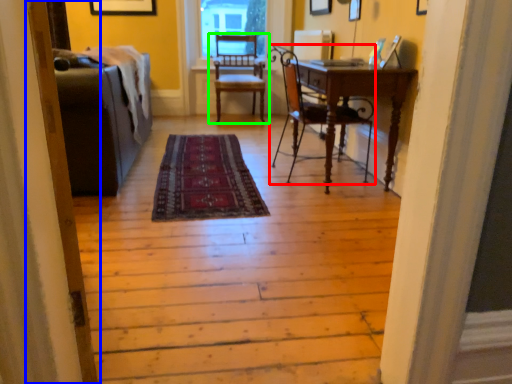
Question: Considering the real-world distances, which object is farthest from chair (highlighted by a red box)? screen door (highlighted by a blue box) or chair (highlighted by a green box)?

Choices:
 (A) screen door
 (B) chair

Answer: (A)